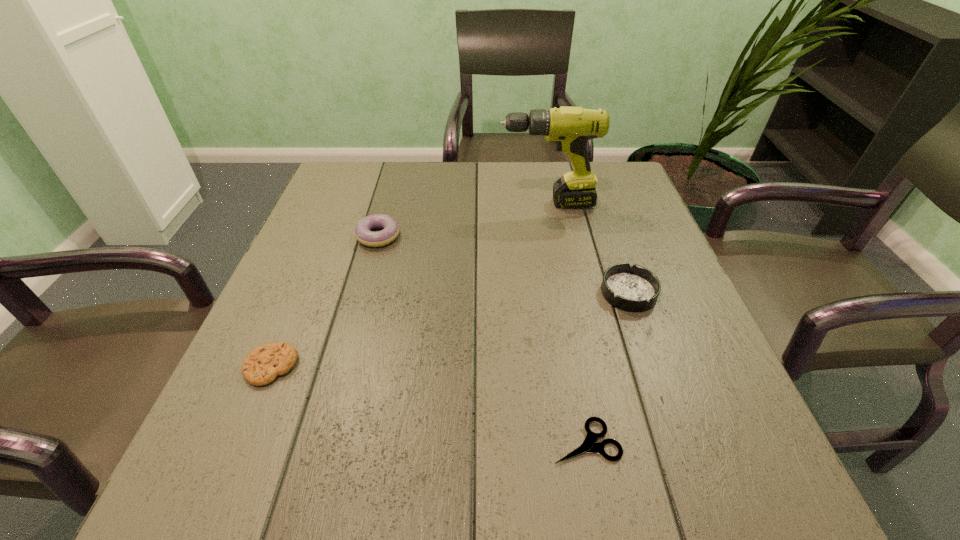
You are a GUI agent. You are given a task and a screenshot of the screen. Output one action in this format:
    pyautogui.click(x=<x>, y=<y>)
    Task: Click on the cookie that is at the left edge
    The image size is (960, 540).
    Given the screenshot: What is the action you would take?
    pyautogui.click(x=262, y=365)

Find the location of `drill that is at the right edge`. drill that is at the right edge is located at coordinates (571, 128).

Locate an element on the screen. This screenshot has width=960, height=540. ashtray located in the right edge section of the desktop is located at coordinates click(x=635, y=288).

The width and height of the screenshot is (960, 540). In order to click on object situated at the far right corner in this screenshot , I will do `click(571, 128)`.

This screenshot has width=960, height=540. In the image, there is a desktop. Find the location of `vacant space at the far edge`. vacant space at the far edge is located at coordinates (552, 180).

I want to click on free point at the left edge, so click(324, 286).

Identify the location of vacant space at the right edge of the desktop. (732, 438).

In the image, there is a desktop. Where is `vacant space at the far left corner`? The image size is (960, 540). vacant space at the far left corner is located at coordinates (346, 186).

The height and width of the screenshot is (540, 960). Identify the location of vacant space at the near left corner of the desktop. (219, 484).

Find the location of a particular element. free space that is in between the third tallest object and the doughnut is located at coordinates (503, 264).